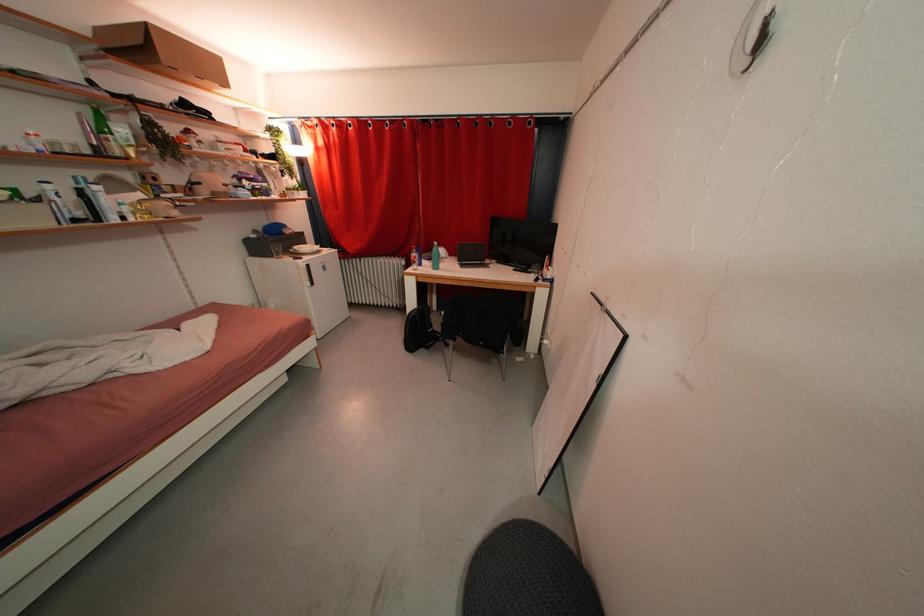
Which object does [434,256] point to?

It corresponds to the green water bottle in the image.